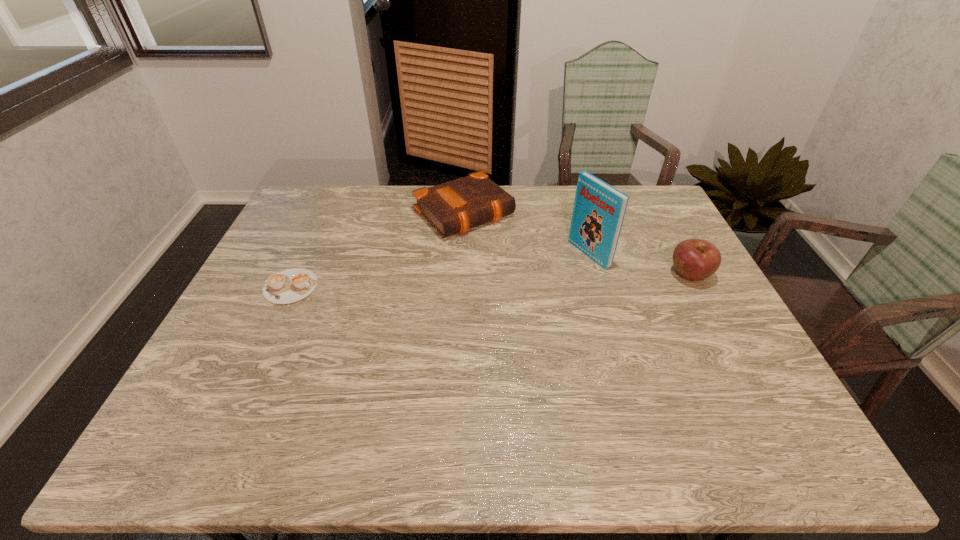
Identify the location of free space located 0.080m on the side of the second tallest object with the unique marking. (640, 275).

Locate an element on the screen. blank space located on the side of the second tallest object with the unique marking is located at coordinates (567, 275).

Where is `free region located 0.390m on the front cover of the tallest object`? Image resolution: width=960 pixels, height=540 pixels. free region located 0.390m on the front cover of the tallest object is located at coordinates (463, 316).

I want to click on vacant space located on the front cover of the tallest object, so click(x=501, y=298).

Where is `free spot located on the front cover of the tallest object`? The image size is (960, 540). free spot located on the front cover of the tallest object is located at coordinates (494, 301).

The height and width of the screenshot is (540, 960). Find the location of `vacant space located on the spine side of the second shortest object`. vacant space located on the spine side of the second shortest object is located at coordinates (520, 264).

The image size is (960, 540). What are the coordinates of `vacant space located 0.370m on the spine side of the second shortest object` in the screenshot? It's located at (569, 310).

I want to click on free space located 0.320m on the spine side of the second shortest object, so [x=557, y=299].

Where is `object that is at the far edge`? object that is at the far edge is located at coordinates (453, 207).

What are the coordinates of `object present at the left edge` in the screenshot? It's located at (289, 286).